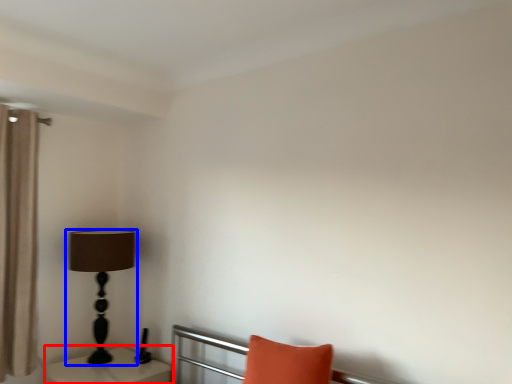
Question: Which of the following is the farthest to the observer, table (highlighted by a red box) or lamp (highlighted by a blue box)?

Choices:
 (A) table
 (B) lamp

Answer: (B)